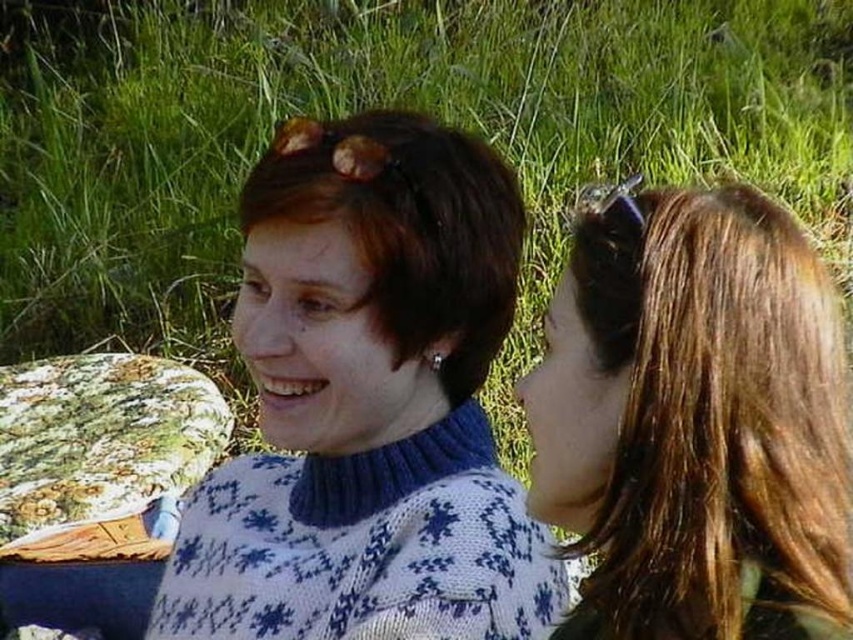
In the scene shown: Is shiny brown hair at right taller than matte blue sweater at center?

Yes, shiny brown hair at right is taller than matte blue sweater at center.

Who is more distant from viewer, (712, 202) or (410, 317)?

The point (410, 317) is more distant.

What are the coordinates of `shiny brown hair at right` in the screenshot? It's located at (694, 419).

Can you confirm if white knitted sweater at center is positioned to the left of shiny brown hair at right?

Yes, white knitted sweater at center is to the left of shiny brown hair at right.

Based on the photo, is white knitted sweater at center taller than shiny brown hair at right?

Correct, white knitted sweater at center is much taller as shiny brown hair at right.

This screenshot has height=640, width=853. I want to click on white knitted sweater at center, so point(368,403).

In order to click on white knitted sweater at center in this screenshot , I will do `click(368, 403)`.

Is white knitted sweater at center to the left of matte blue sweater at center from the viewer's perspective?

Correct, you'll find white knitted sweater at center to the left of matte blue sweater at center.

Identify the location of white knitted sweater at center. This screenshot has height=640, width=853. [368, 403].